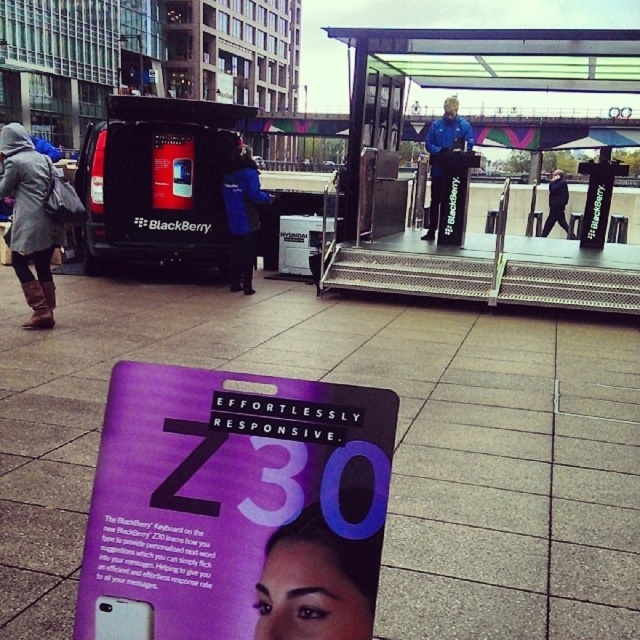
You are attending the BlackBerry event and want to approach the stage. You are currently standing near the leather boots at lower left and the blue fabric jacket at center. Which object should you move towards to get closer to the stage?

The blue fabric jacket at center is farther from the stage than the leather boots at lower left. To get closer to the stage, move towards the leather boots at lower left since it is closer to the viewer and thus closer to the stage.

You are attending the BlackBerry event and want to take a photo of both the smooth purple poster at center and the blue jacket at center. Which object should you focus on first if you want to capture both in the same frame without moving your camera?

The smooth purple poster at center has a lesser height compared to blue jacket at center. Therefore, you should focus on the blue jacket at center first since it is taller and will require more space in the frame to capture fully.

You are a photographer standing in the public square and want to take a photo of both the purple advertisement and the stage. You notice two points marked in the scene. The first point is at coordinate point (35, 218) and the second is at point (444, 131). Which point is closer to your camera lens?

Point (35, 218) is closer to the camera than point (444, 131).